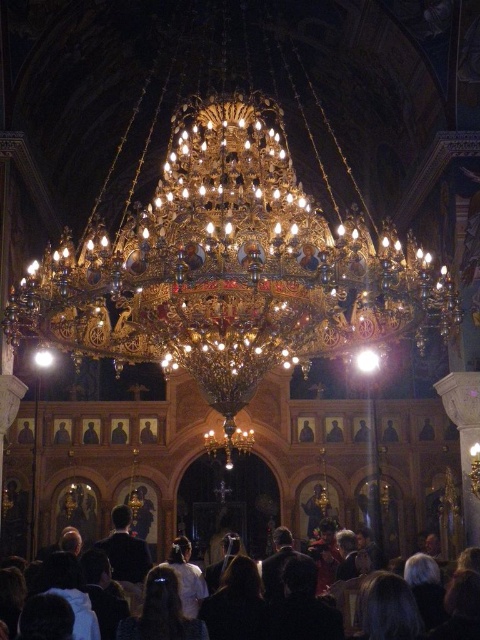
Looking at this image, you are an interior designer planning to install a spotlight above the dark brown wooden icon at center and the dark brown wooden figure at center. Which object should the spotlight be placed above to ensure it shines directly on the icon?

The dark brown wooden icon at center is positioned under the dark brown wooden figure at center, so the spotlight should be placed above the dark brown wooden figure at center to shine directly on the icon.

You are standing at the entrance of the church and want to see both the wooden portrait at center and the dark brown wooden figure at center. Which one will you see first as you walk towards the altar?

The wooden portrait at center will be seen first because the dark brown wooden figure at center is positioned behind it, making the portrait more visible from the entrance.

You are an interior designer planning to place a new decorative item in the church. You have two options to choose from. The first is a large golden vase that requires a space of at least 1 meter in width. The second is a smaller candle holder that needs only 0.5 meters. Based on the scene, which item would fit better between the wooden framed portrait at center and the wooden icon at center?

The wooden framed portrait at center is wider than the wooden icon at center. Since the portrait is wider, the smaller candle holder requiring 0.5 meters would fit better between them as it requires less space compared to the larger vase needing 1 meter.